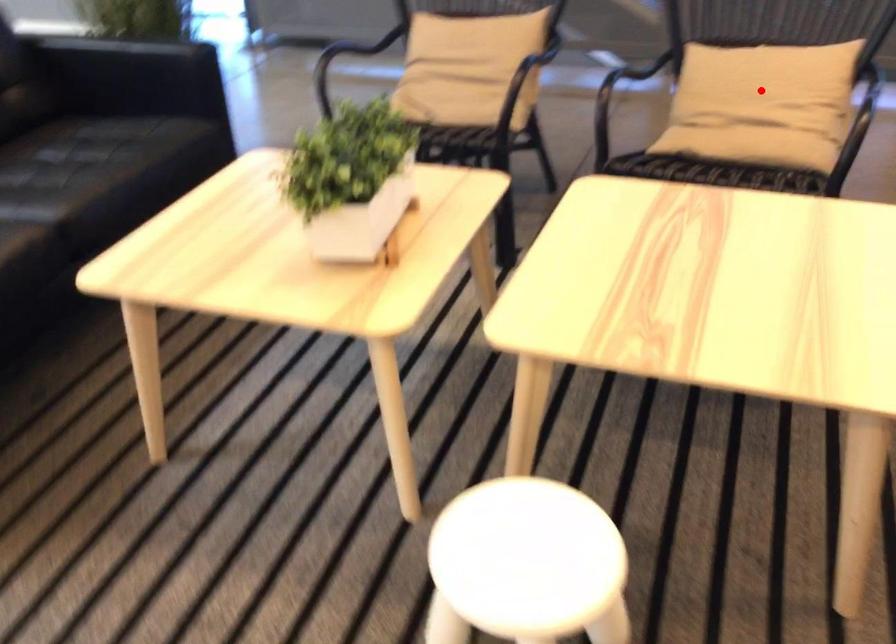
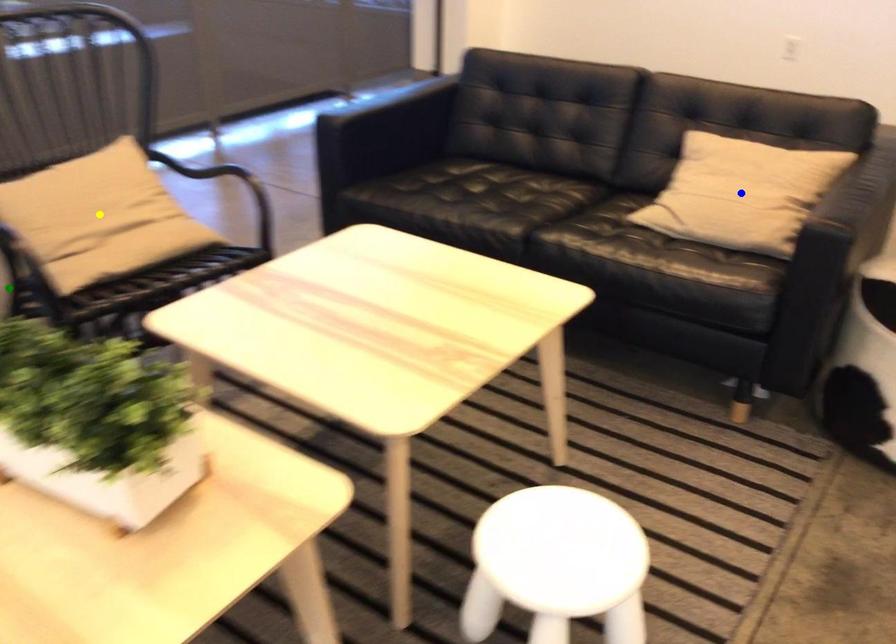
Question: I am providing you with two images of the same scene from different viewpoints. A red point is marked on the first image. You are given multiple points on the second image. Which point in image 2 represents the same 3d spot as the red point in image 1?

Choices:
 (A) green point
 (B) yellow point
 (C) blue point

Answer: (B)